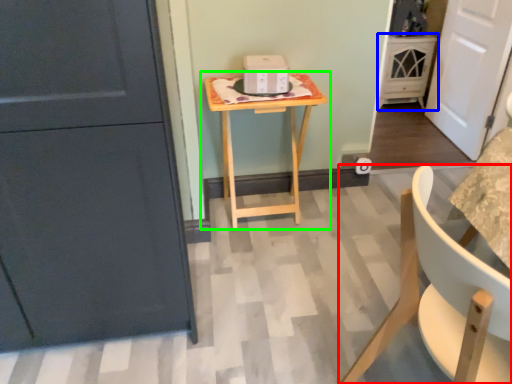
Question: Which object is the farthest from chair (highlighted by a red box)? Choose among these: cabinetry (highlighted by a blue box) or table (highlighted by a green box).

Choices:
 (A) cabinetry
 (B) table

Answer: (A)